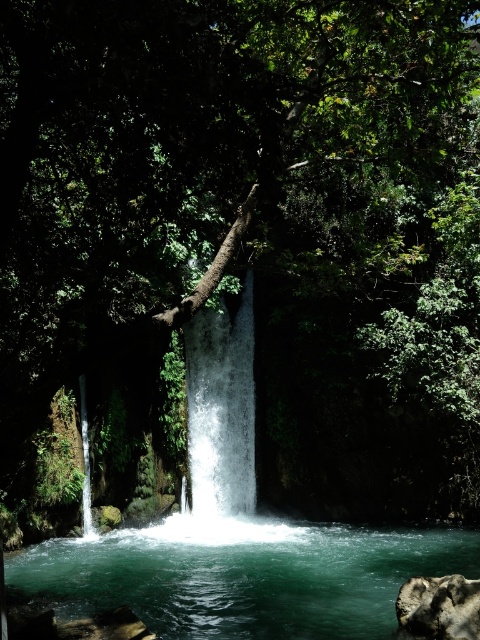
Question: Is clear water at center below white frothy water at center?

Choices:
 (A) no
 (B) yes

Answer: (B)

Question: Which point is closer to the camera?

Choices:
 (A) (423, 608)
 (B) (152, 556)
 (C) (215, 349)

Answer: (A)

Question: Which point appears closest to the camera in this image?

Choices:
 (A) 331,600
 (B) 236,317

Answer: (A)

Question: Which is nearer to the gray rough rock at lower right?

Choices:
 (A) white frothy water at center
 (B) clear water at center

Answer: (B)

Question: Is clear water at center positioned in front of gray rough rock at lower right?

Choices:
 (A) no
 (B) yes

Answer: (A)

Question: Is clear water at center thinner than gray rough rock at lower right?

Choices:
 (A) no
 (B) yes

Answer: (A)